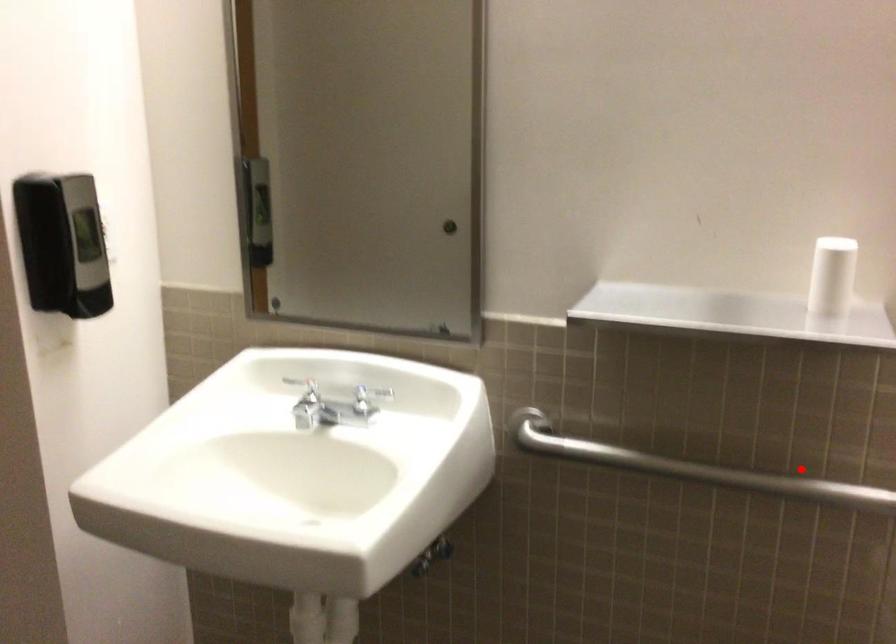
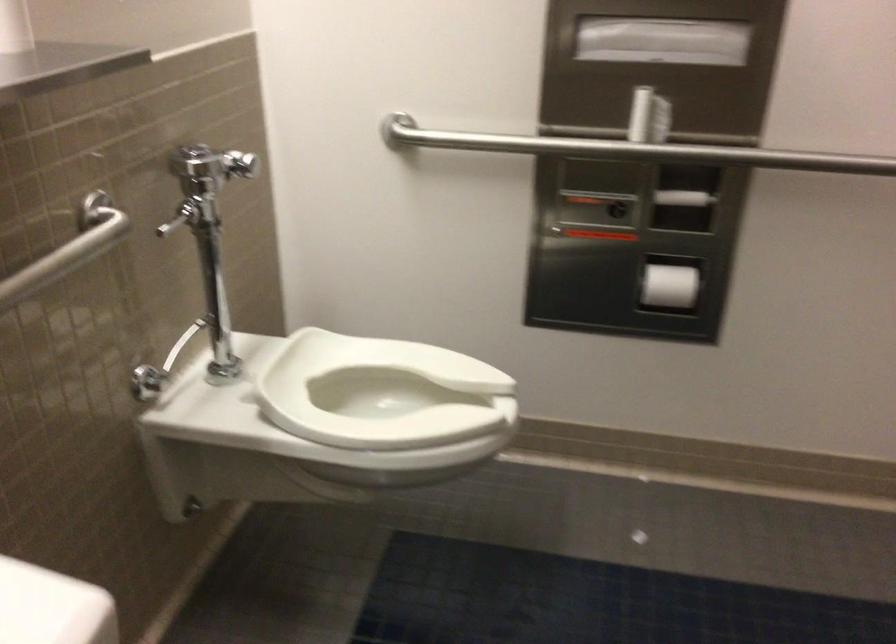
Question: A red point is marked in image1. In image2, is the corresponding 3D point closer to the camera or farther? Reply with the corresponding letter.

Choices:
 (A) The corresponding 3D point is closer.
 (B) The corresponding 3D point is farther.

Answer: (A)